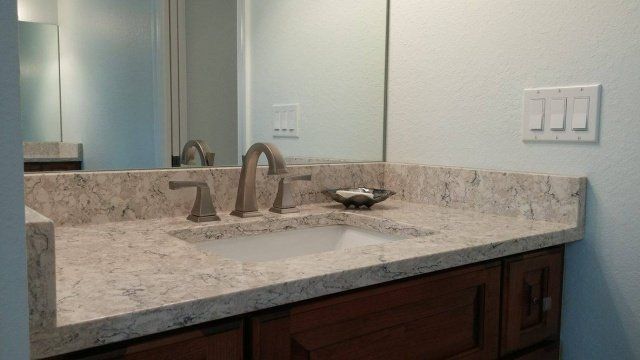
Locate an element on the screen. This screenshot has width=640, height=360. cabinet doors is located at coordinates (411, 314), (185, 345), (522, 305).